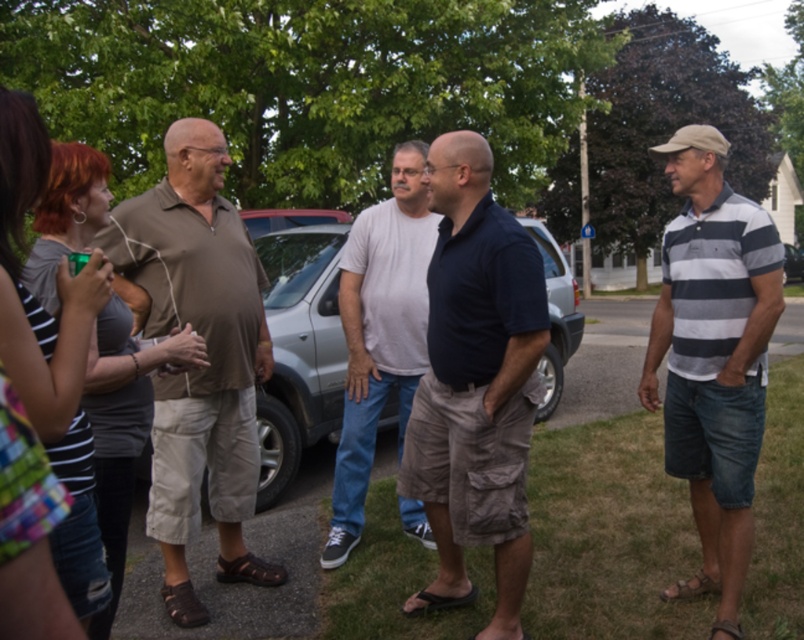
You are a photographer trying to capture a group photo of the matte brown shirt at left and the metallic silver car at center. Since the car is wider, how should you position the camera to ensure both subjects are fully visible in the frame?

The matte brown shirt at left is thinner than the metallic silver car at center, so to include both in the frame, position the camera slightly closer to the matte brown shirt at left while ensuring the metallic silver car at center is still within the shot.

You are a photographer trying to capture a clear shot of the matte brown shirt at left and the metallic silver car at center. Since you want both subjects in focus, which one should you focus on first to ensure depth of field?

The matte brown shirt at left is closer to the viewer than the metallic silver car at center. To ensure both are in focus, you should focus on the matte brown shirt at left first, as focusing on closer objects allows the depth of field to extend further back, covering the metallic silver car at center.